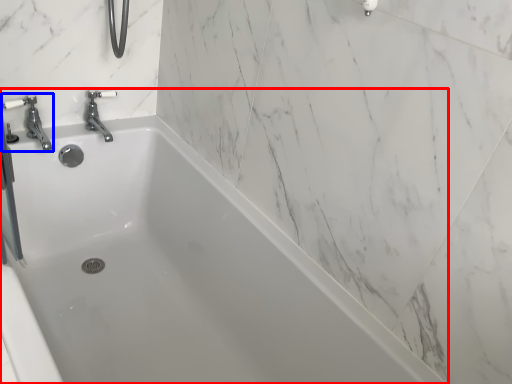
Question: Which object appears closest to the camera in this image, bathtub (highlighted by a red box) or tap (highlighted by a blue box)?

Choices:
 (A) bathtub
 (B) tap

Answer: (A)